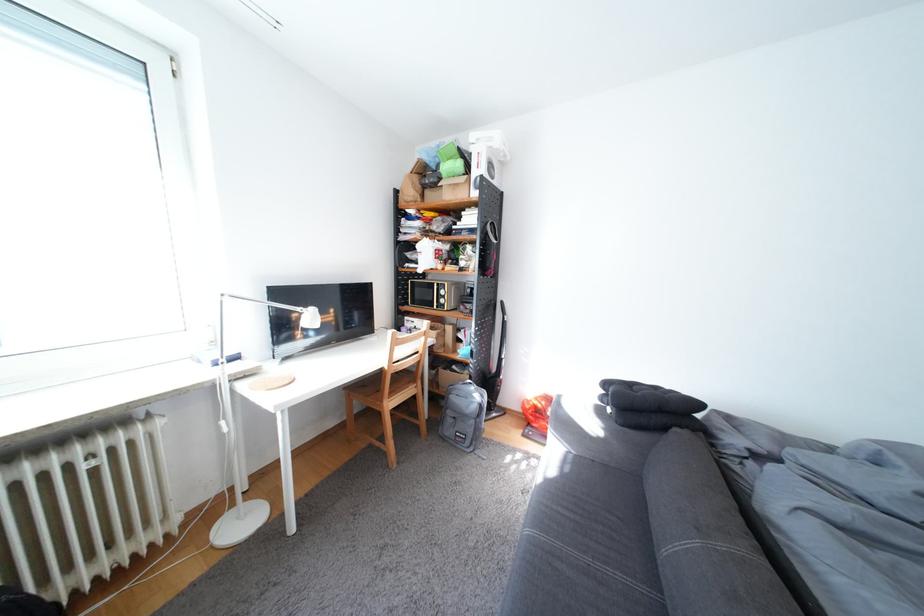
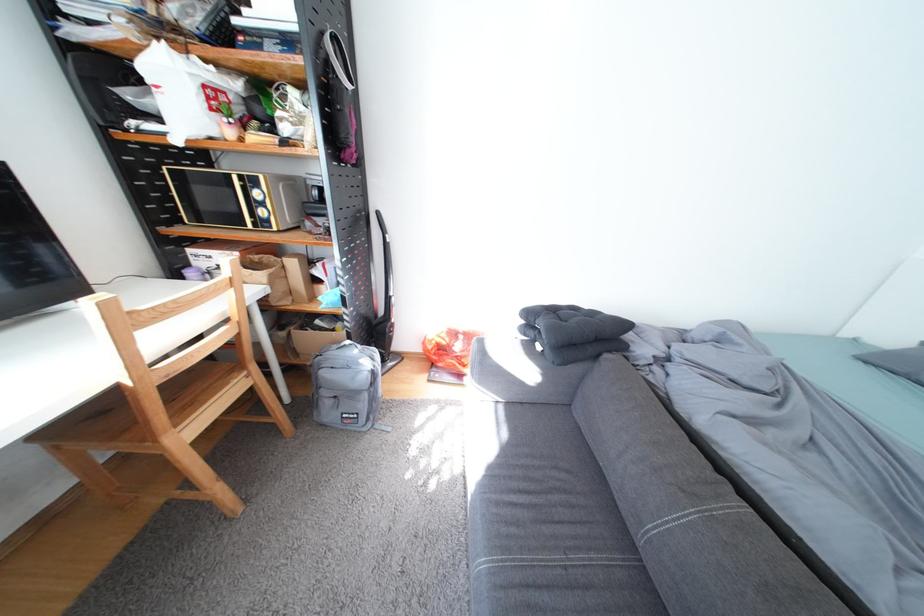
Find the pixel in the second image that matches point (485, 423) in the first image.

(378, 397)